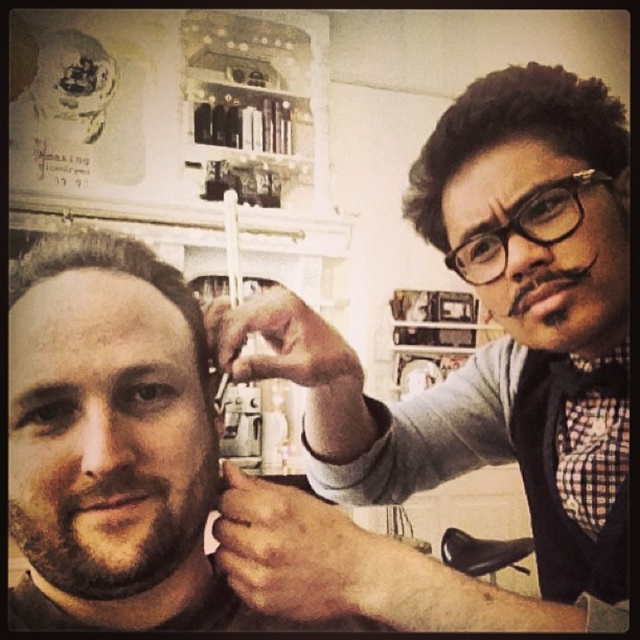
Which of these two, brownroughbeard at left or black textured hair at upper right, stands shorter?

With less height is brownroughbeard at left.

The height and width of the screenshot is (640, 640). What are the coordinates of `brownroughbeard at left` in the screenshot? It's located at (109, 508).

Who is shorter, black textured hair at upper right or brown matte hair at center?

Standing shorter between the two is brown matte hair at center.

Which is above, black textured hair at upper right or brown matte hair at center?

black textured hair at upper right is higher up.

From the picture: Measure the distance between point [477,99] and camera.

A distance of 30.40 inches exists between point [477,99] and camera.

I want to click on black textured hair at upper right, so click(x=515, y=132).

Which is behind, point (42, 531) or point (49, 237)?

The point (49, 237) is behind.

The width and height of the screenshot is (640, 640). What do you see at coordinates (109, 508) in the screenshot? I see `brownroughbeard at left` at bounding box center [109, 508].

Find the location of `brownroughbeard at left`. brownroughbeard at left is located at coordinates (109, 508).